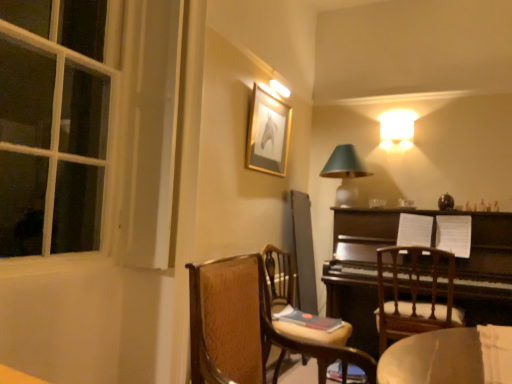
Question: Could you tell me if dark brown polished wood piano at right is turned towards matte green glass table lamp at upper right?

Choices:
 (A) no
 (B) yes

Answer: (A)

Question: Considering the relative sizes of dark brown polished wood piano at right and matte green glass table lamp at upper right in the image provided, is dark brown polished wood piano at right taller than matte green glass table lamp at upper right?

Choices:
 (A) yes
 (B) no

Answer: (A)

Question: Is dark brown polished wood piano at right positioned behind matte green glass table lamp at upper right?

Choices:
 (A) yes
 (B) no

Answer: (B)

Question: Does dark brown polished wood piano at right have a larger size compared to matte green glass table lamp at upper right?

Choices:
 (A) yes
 (B) no

Answer: (A)

Question: Can you confirm if dark brown polished wood piano at right is positioned to the right of matte green glass table lamp at upper right?

Choices:
 (A) no
 (B) yes

Answer: (B)

Question: From the image's perspective, would you say dark brown polished wood piano at right is shown under matte green glass table lamp at upper right?

Choices:
 (A) no
 (B) yes

Answer: (B)

Question: From a real-world perspective, does gold-framed picture at upper center stand above wooden chair at center, placed as the 3th chair when sorted from back to front?

Choices:
 (A) no
 (B) yes

Answer: (B)

Question: Is the surface of gold-framed picture at upper center in direct contact with wooden chair at center, placed as the 1th chair when sorted from front to back?

Choices:
 (A) yes
 (B) no

Answer: (B)

Question: Does gold-framed picture at upper center have a greater height compared to wooden chair at center, placed as the 1th chair when sorted from front to back?

Choices:
 (A) no
 (B) yes

Answer: (B)

Question: Would you say gold-framed picture at upper center is a long distance from wooden chair at center, placed as the 3th chair when sorted from back to front?

Choices:
 (A) yes
 (B) no

Answer: (A)

Question: Does gold-framed picture at upper center have a greater width compared to wooden chair at center, placed as the 3th chair when sorted from back to front?

Choices:
 (A) yes
 (B) no

Answer: (B)

Question: Would you say gold-framed picture at upper center is outside wooden chair at center, placed as the 1th chair when sorted from front to back?

Choices:
 (A) no
 (B) yes

Answer: (B)

Question: Is wooden chair at center, placed as the 3th chair when sorted from back to front, outside gold-framed picture at upper center?

Choices:
 (A) no
 (B) yes

Answer: (B)